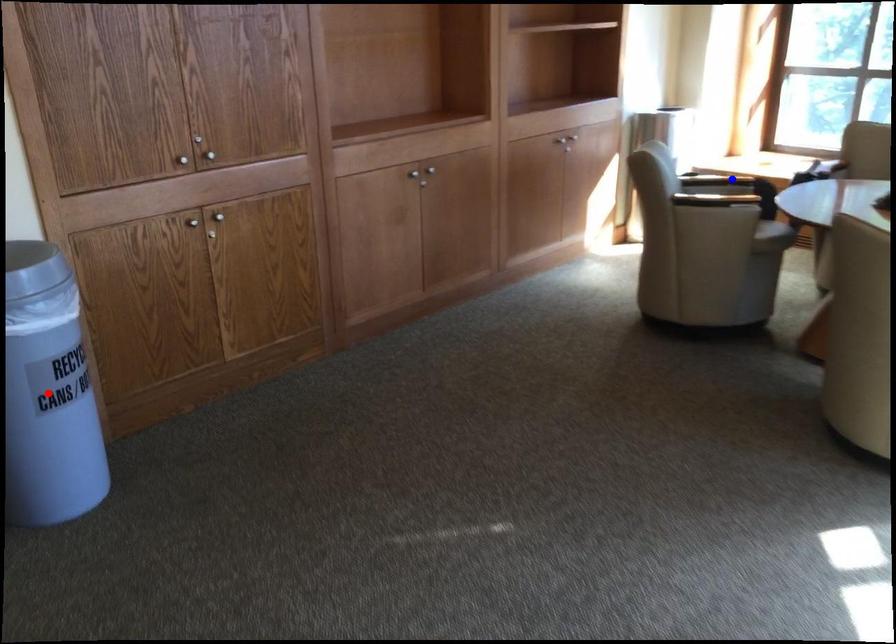
Question: Two points are marked on the image. Which point is closer to the camera?

Choices:
 (A) Blue point is closer.
 (B) Red point is closer.

Answer: (B)